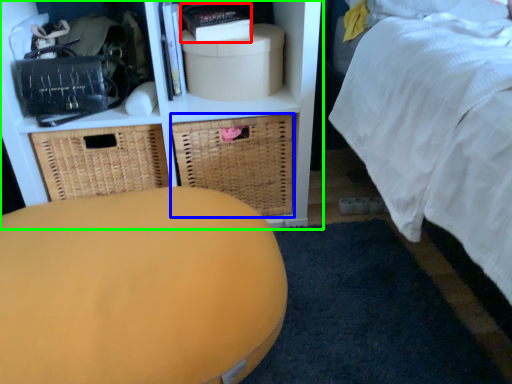
Question: Based on their relative distances, which object is farther from book (highlighted by a red box)? Choose from basket (highlighted by a blue box) and shelf (highlighted by a green box).

Choices:
 (A) basket
 (B) shelf

Answer: (A)